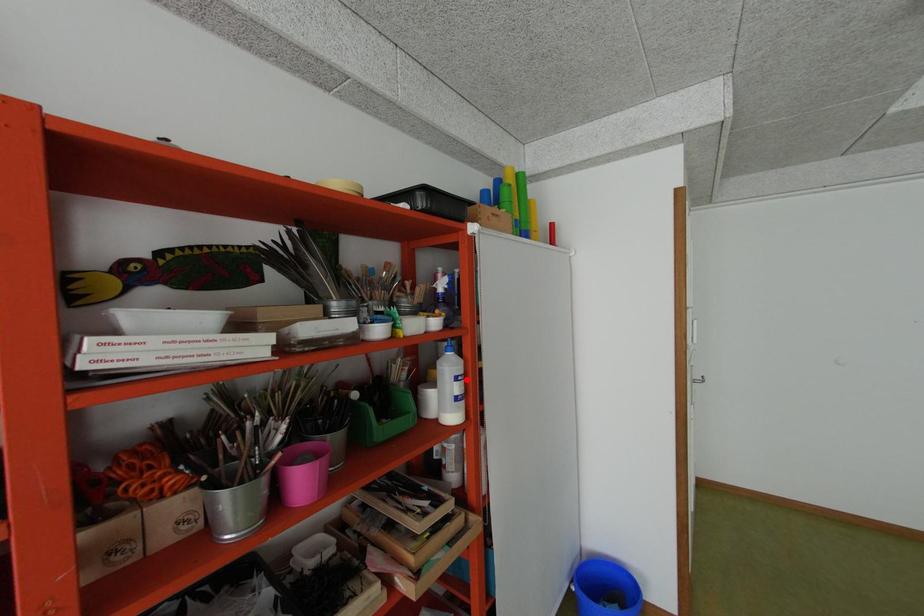
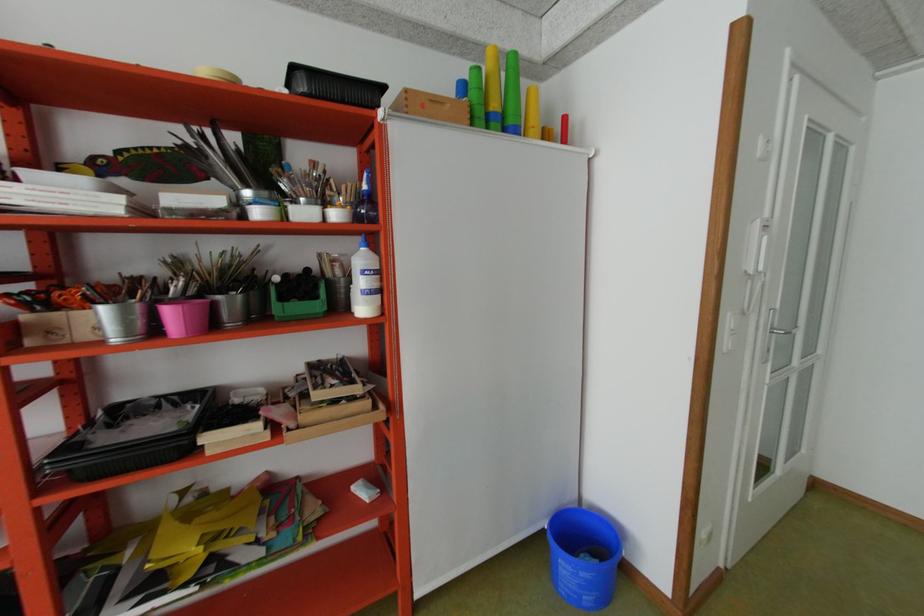
Locate, in the second image, the point that corresponds to the highlighted location in the first image.

(372, 273)